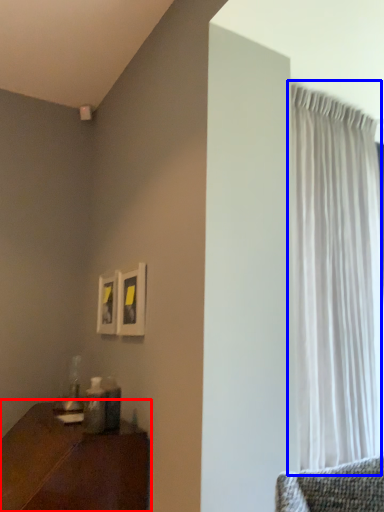
Question: Which of the following is the closest to the observer, table (highlighted by a red box) or curtain (highlighted by a blue box)?

Choices:
 (A) table
 (B) curtain

Answer: (A)